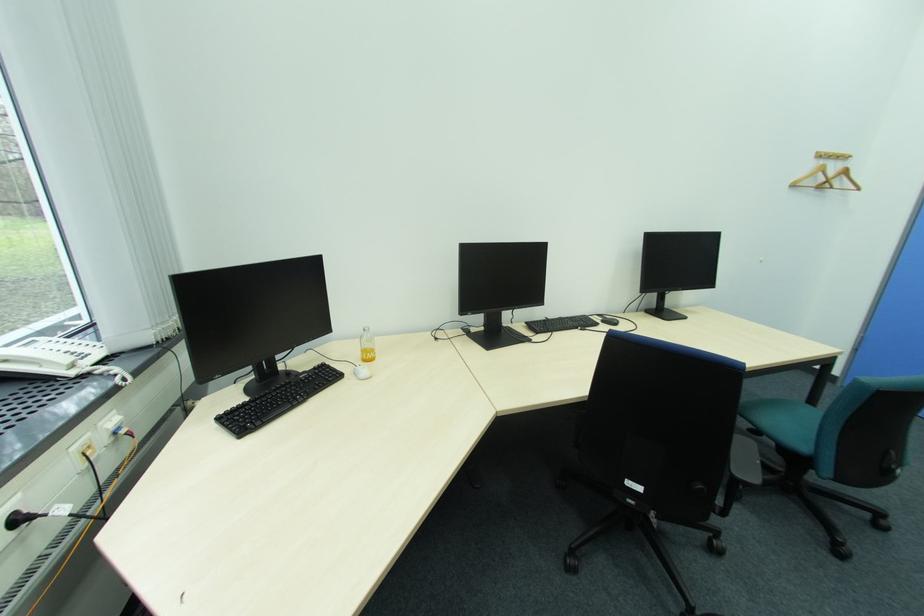
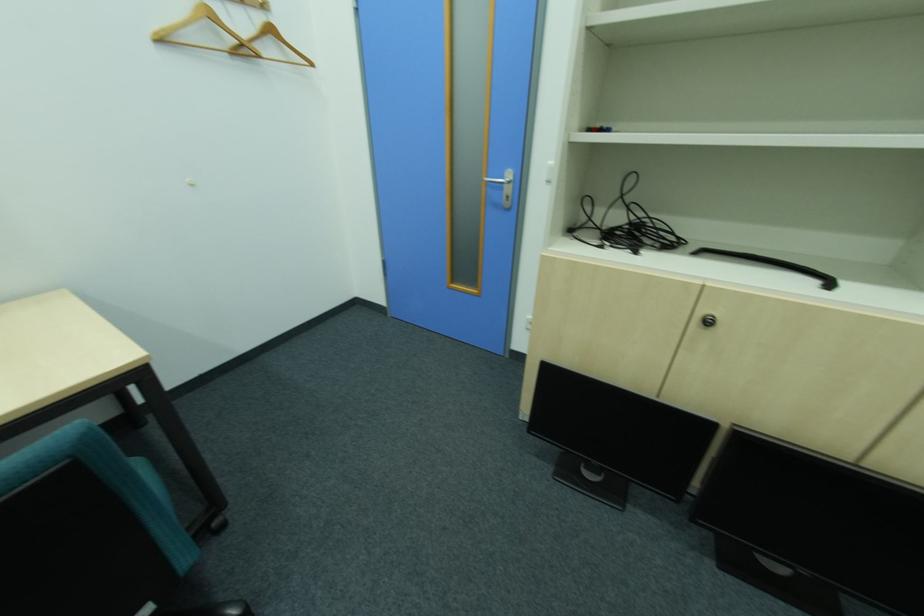
Find the pixel in the second image that matches point (832, 183) in the first image.

(249, 45)